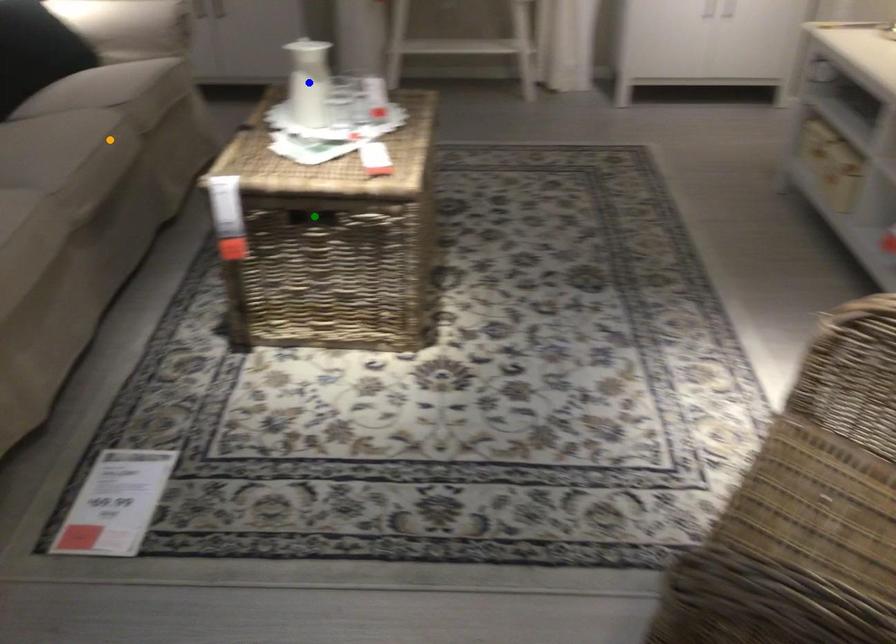
From the picture: Order these from nearest to farthest:
A) orange point
B) blue point
C) green point

green point
blue point
orange point